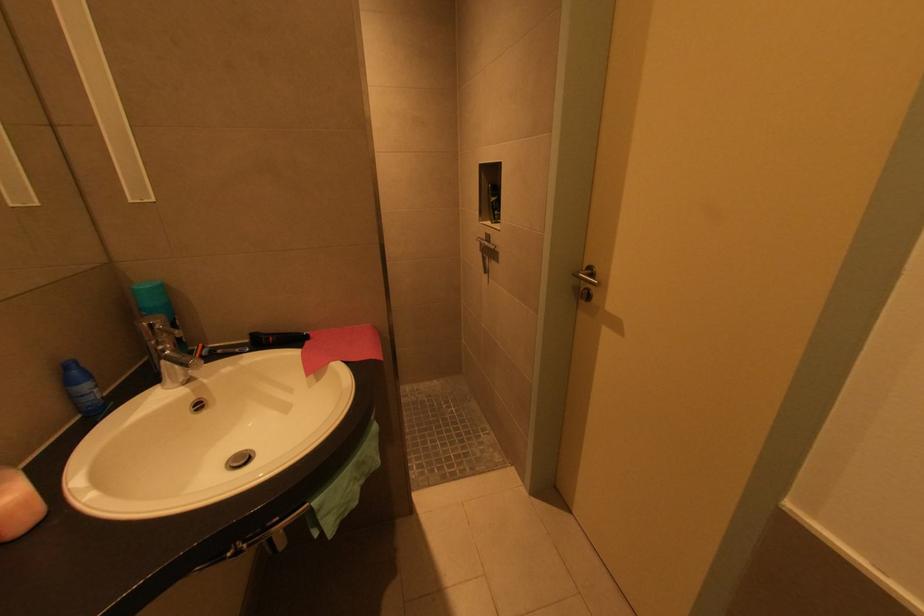
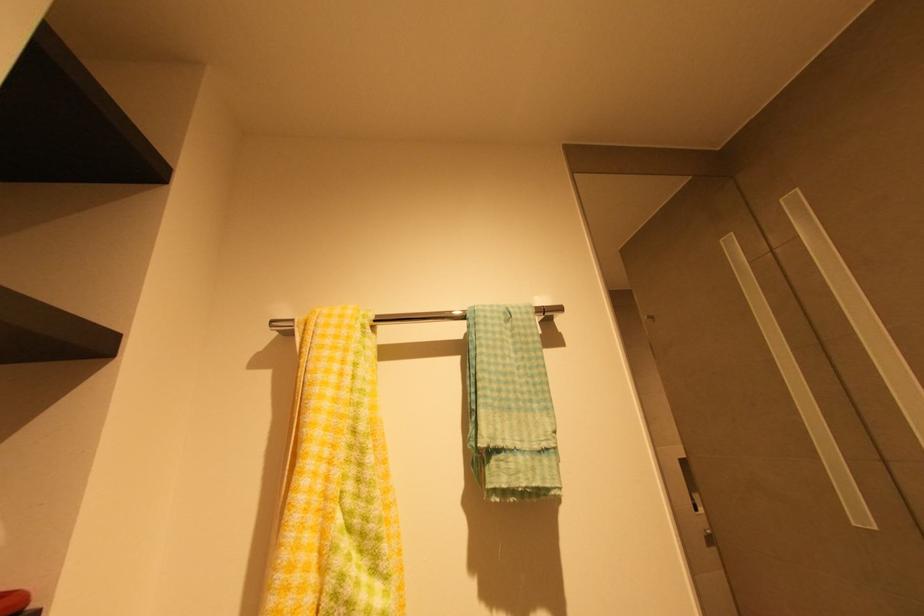
Based on the continuous images, in which direction is the camera rotating?

The camera's rotation is toward left-up.